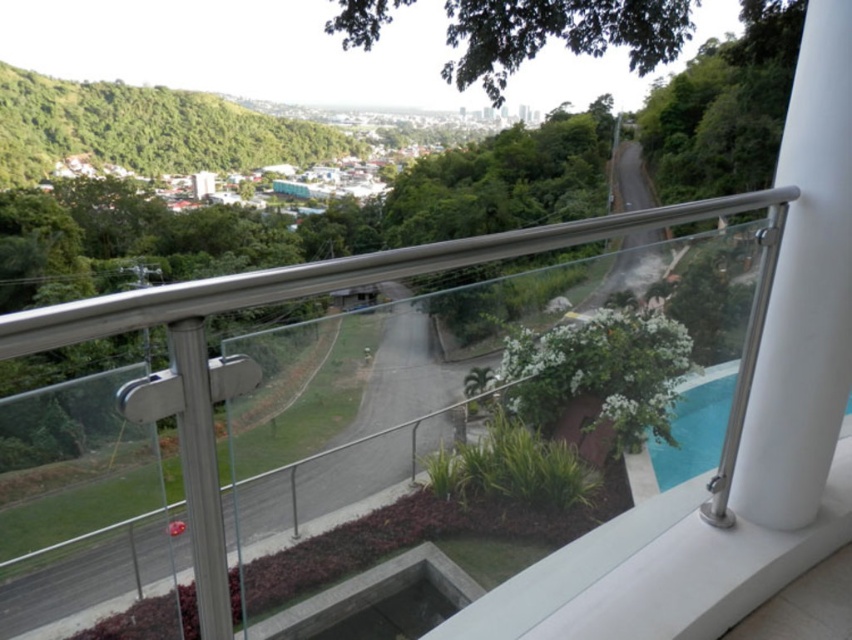
Is point (806, 426) closer to viewer compared to point (204, 481)?

No, it is behind (204, 481).

In the scene shown: Does white glossy pillar at right lie behind satin silver railing at upper center?

Yes, it is behind satin silver railing at upper center.

Find the location of `white glossy pillar at right`. white glossy pillar at right is located at coordinates (804, 292).

Does white glossy pillar at right lie behind green leafy hillside at upper left?

That is False.

Is white glossy pillar at right to the right of green leafy hillside at upper left from the viewer's perspective?

Yes, white glossy pillar at right is to the right of green leafy hillside at upper left.

Is point (802, 132) positioned after point (33, 104)?

No, (802, 132) is closer to viewer.

Identify the location of white glossy pillar at right. The width and height of the screenshot is (852, 640). (804, 292).

Does green leafy hillside at upper left have a greater width compared to blue glass swimming pool at lower right?

Indeed, green leafy hillside at upper left has a greater width compared to blue glass swimming pool at lower right.

Between point (35, 132) and point (683, 406), which one is positioned behind?

The point (35, 132) is more distant.

Image resolution: width=852 pixels, height=640 pixels. Identify the location of green leafy hillside at upper left. (144, 129).